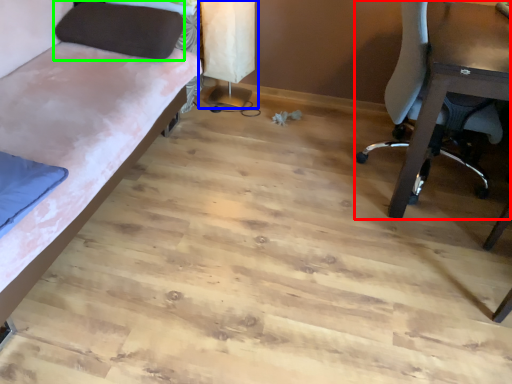
Question: Estimate the real-world distances between objects in this image. Which object is closer to chair (highlighted by a red box), table lamp (highlighted by a blue box) or pillow (highlighted by a green box)?

Choices:
 (A) table lamp
 (B) pillow

Answer: (A)